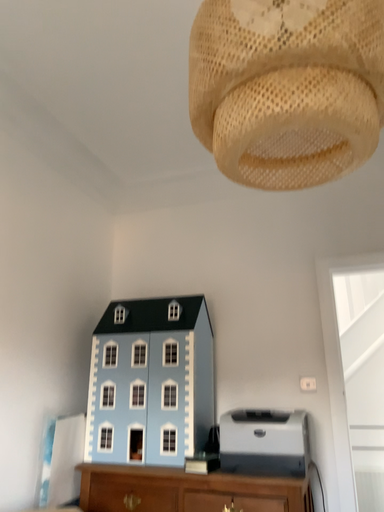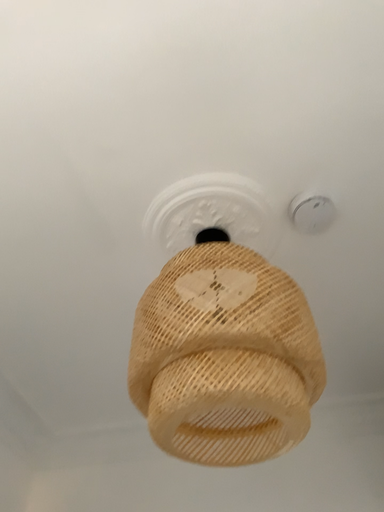
Question: Which way did the camera rotate in the video?

Choices:
 (A) rotated left
 (B) rotated right

Answer: (B)